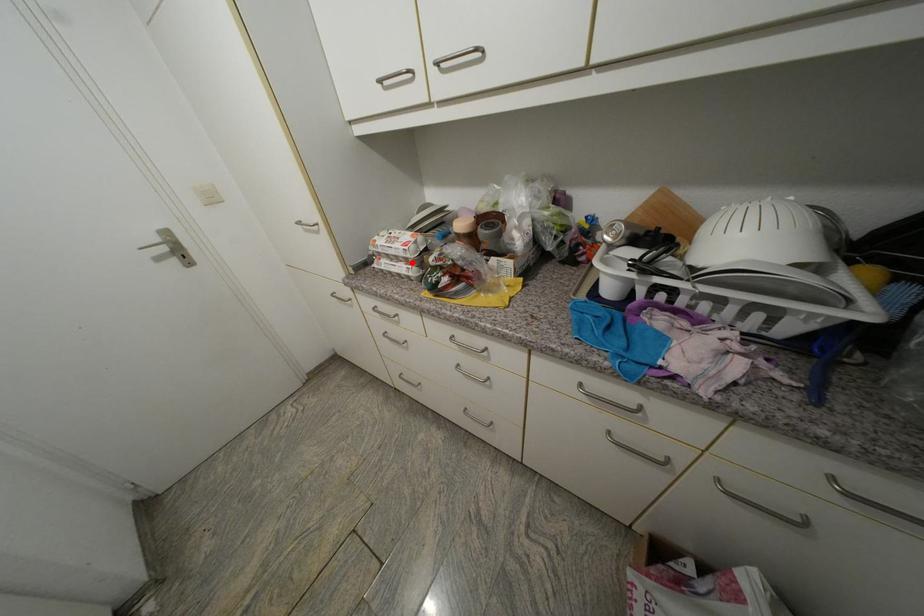
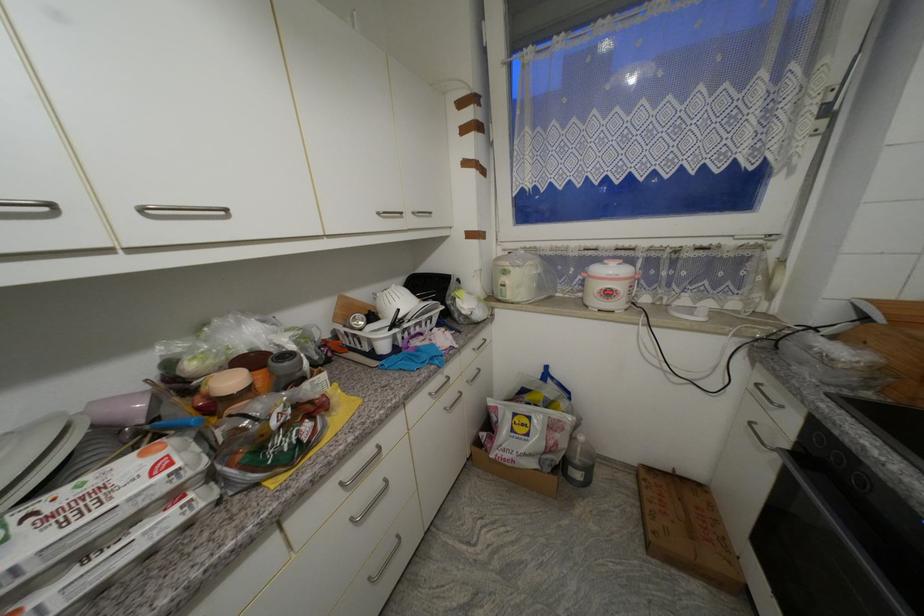
The point at the highlighted location is marked in the first image. Where is the corresponding point in the second image?

(178, 498)